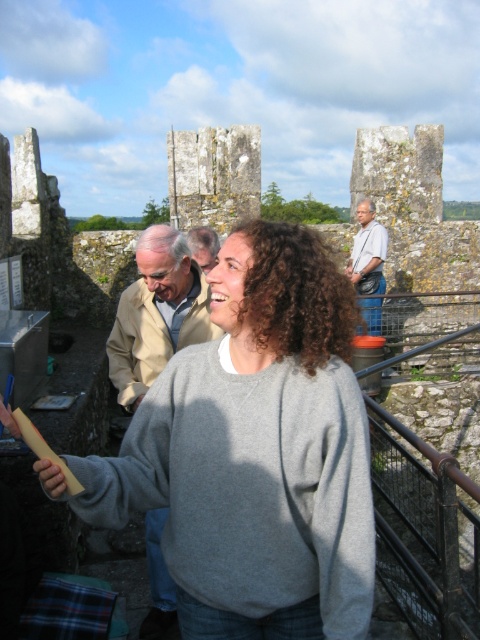
Question: Among these objects, which one is nearest to the camera?

Choices:
 (A) gray cotton sweater at center
 (B) gray wool sweater at center

Answer: (A)

Question: Which object is farther from the camera taking this photo?

Choices:
 (A) gray cotton sweater at center
 (B) light brown leather jacket at upper right
 (C) gray wool sweater at center

Answer: (B)

Question: Observing the image, what is the correct spatial positioning of gray cotton sweater at center in reference to light beige jacket at center?

Choices:
 (A) below
 (B) above

Answer: (B)

Question: Can you confirm if gray cotton sweater at center is thinner than light beige jacket at center?

Choices:
 (A) no
 (B) yes

Answer: (A)

Question: Among these points, which one is nearest to the camera?

Choices:
 (A) (372, 248)
 (B) (192, 241)

Answer: (B)

Question: Is gray cotton sweater at center thinner than light beige jacket at center?

Choices:
 (A) no
 (B) yes

Answer: (A)